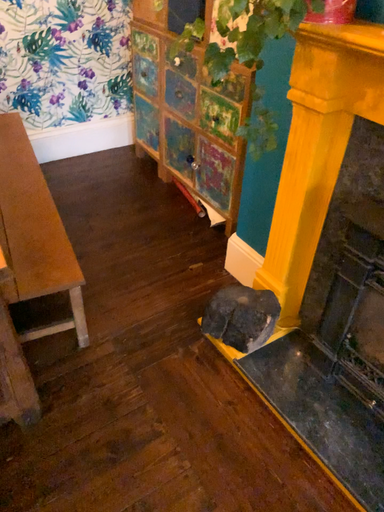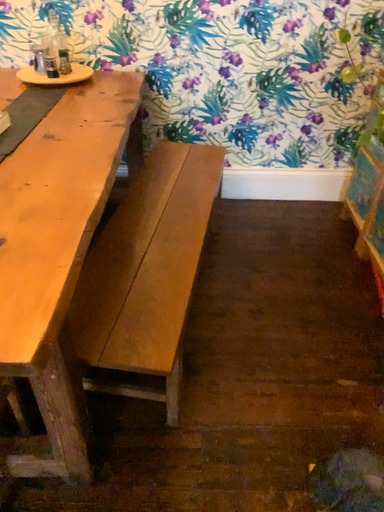
Question: How did the camera likely rotate when shooting the video?

Choices:
 (A) rotated right
 (B) rotated left

Answer: (B)